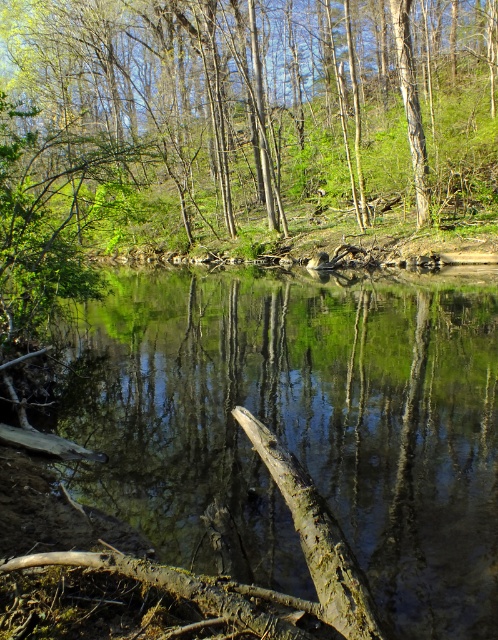
Question: Does brown muddy river at center appear on the left side of smooth bark tree at center?

Choices:
 (A) no
 (B) yes

Answer: (A)

Question: Which point is farther to the camera?

Choices:
 (A) (420, 129)
 (B) (143, 381)

Answer: (A)

Question: Which point is farther from the camera taking this photo?

Choices:
 (A) (485, 576)
 (B) (59, 24)

Answer: (B)

Question: Is brown muddy river at center wider than smooth bark tree at center?

Choices:
 (A) no
 (B) yes

Answer: (A)

Question: From the image, what is the correct spatial relationship of brown muddy river at center in relation to smooth bark tree at center?

Choices:
 (A) right
 (B) left

Answer: (A)